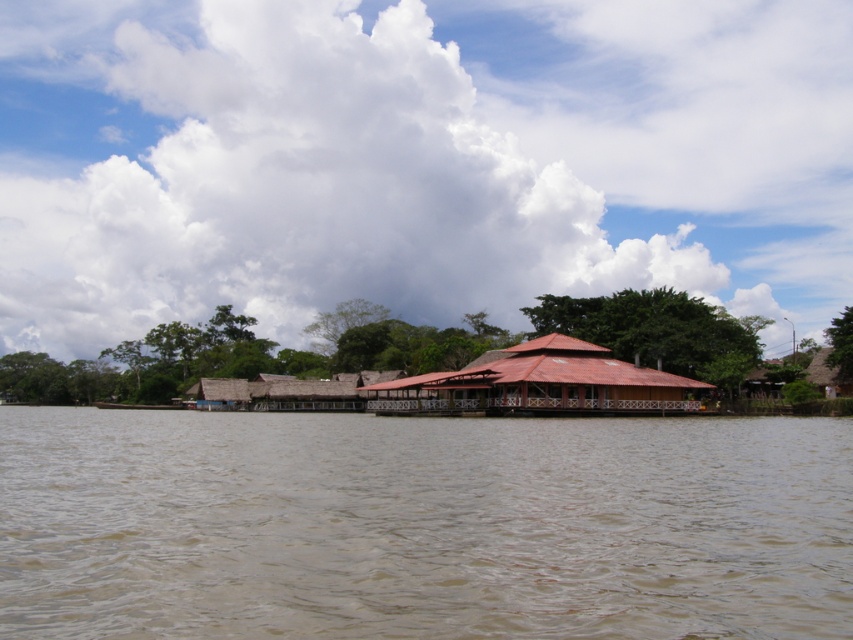
Can you confirm if brown muddy water at center is positioned to the left of red thatched hut at center?

Indeed, brown muddy water at center is positioned on the left side of red thatched hut at center.

Which is above, brown muddy water at center or red thatched hut at center?

red thatched hut at center is above.

Where is `brown muddy water at center`? brown muddy water at center is located at coordinates (421, 525).

At what (x,y) coordinates should I click in order to perform the action: click on brown muddy water at center. Please return your answer as a coordinate pair (x, y). This screenshot has height=640, width=853. Looking at the image, I should click on (421, 525).